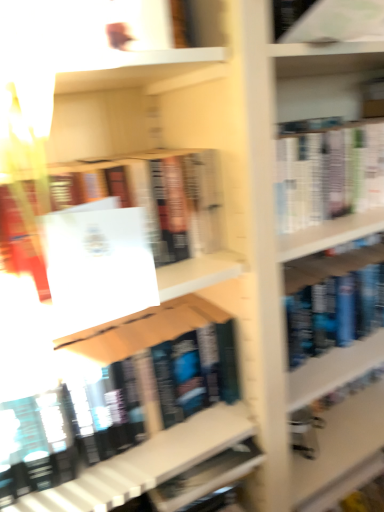
Question: Considering the positions of white paper at upper center, the second book from the top, and matte black book at center, which appears as the first book when ordered from the bottom, in the image, is white paper at upper center, the second book from the top, wider or thinner than matte black book at center, which appears as the first book when ordered from the bottom,?

Choices:
 (A) thin
 (B) wide

Answer: (A)

Question: Would you say white paper at upper center, the second book from the top, is to the left or to the right of matte black book at center, which appears as the first book when ordered from the bottom, in the picture?

Choices:
 (A) right
 (B) left

Answer: (A)

Question: Which object is positioned closest to the matte black book at center, marked as the third book in a top-to-bottom arrangement?

Choices:
 (A) white matte paper at center
 (B) white paper at upper right, which appears as the first book when viewed from the top
 (C) white paper at upper center, which is the second book from bottom to top

Answer: (A)

Question: Which of these objects is positioned farthest from the white matte paper at center?

Choices:
 (A) white paper at upper center, which is the second book from bottom to top
 (B) matte black book at center, which appears as the first book when ordered from the bottom
 (C) white paper at upper right, the 3th book in the bottom-to-top sequence

Answer: (C)